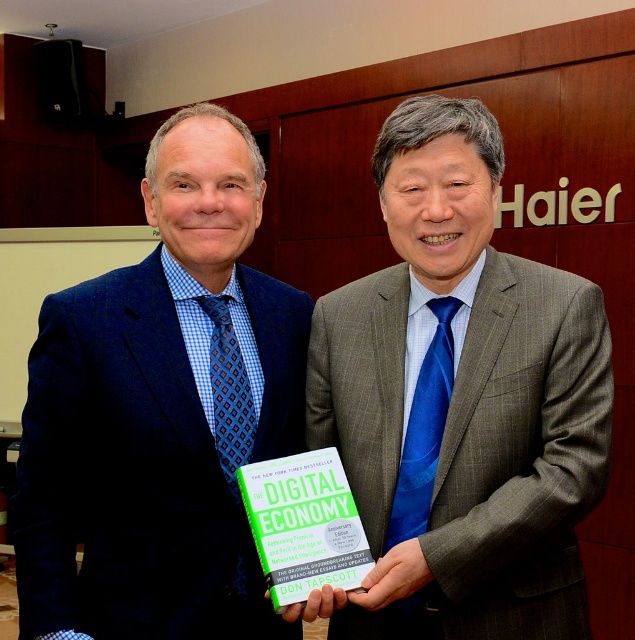
Is blue silk tie at center wider than blue checkered fabric suit at left?

Correct, the width of blue silk tie at center exceeds that of blue checkered fabric suit at left.

Which is more to the left, blue silk tie at center or blue checkered fabric suit at left?

Positioned to the left is blue checkered fabric suit at left.

Is point (572, 310) positioned before point (201, 189)?

Yes, it is.

Locate an element on the screen. The height and width of the screenshot is (640, 635). blue silk tie at center is located at coordinates click(x=460, y=403).